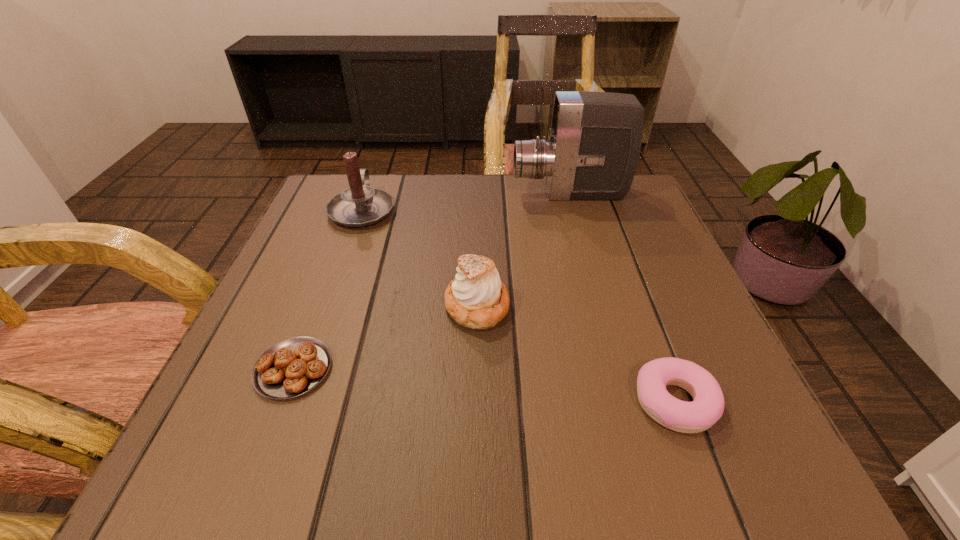
What are the coordinates of `camcorder` in the screenshot? It's located at click(x=594, y=143).

The image size is (960, 540). I want to click on the second tallest object, so click(x=359, y=205).

The image size is (960, 540). I want to click on the farthest pastry, so click(477, 299).

The width and height of the screenshot is (960, 540). What are the coordinates of `the third shortest object` in the screenshot? It's located at (477, 299).

Where is `the rightmost pastry`? the rightmost pastry is located at coordinates (699, 415).

The image size is (960, 540). I want to click on the second shortest object, so click(699, 415).

Find the location of `the shortest object`. the shortest object is located at coordinates (292, 367).

The width and height of the screenshot is (960, 540). I want to click on the leftmost pastry, so click(292, 367).

The width and height of the screenshot is (960, 540). I want to click on free space located at the front of the camcorder, highlighting the lens, so click(x=458, y=194).

Find the location of a particular element. vacant space located 0.080m at the front of the camcorder, highlighting the lens is located at coordinates (479, 194).